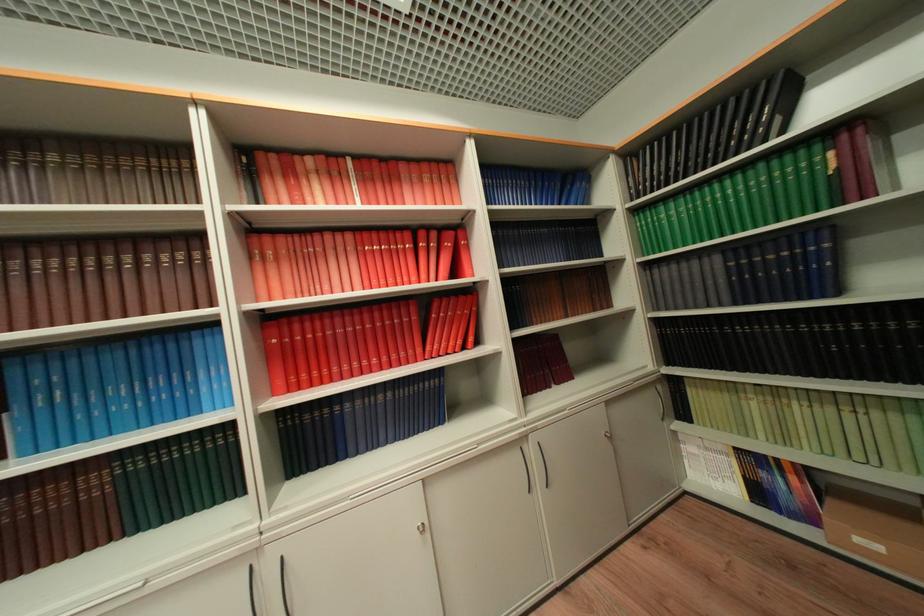
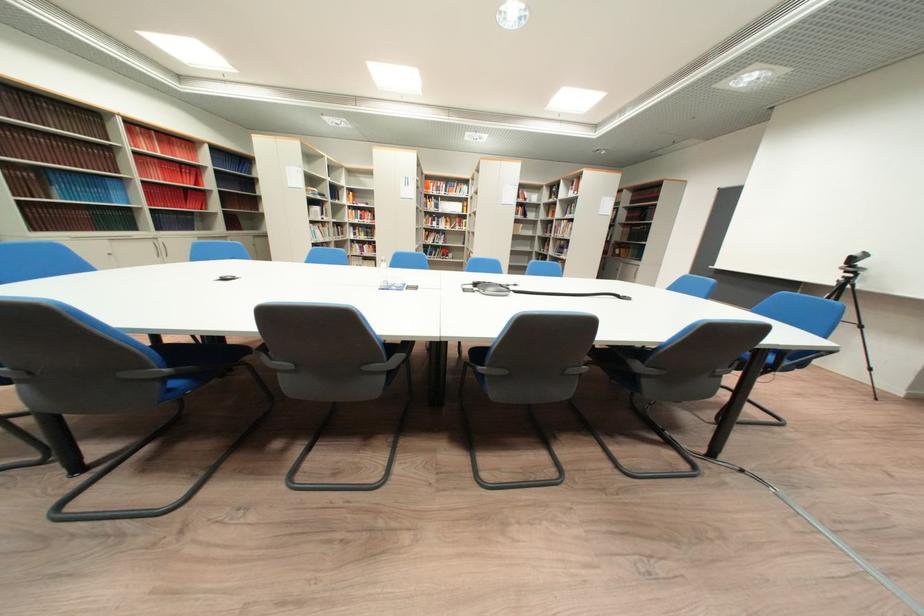
Question: I am providing you with two images of the same scene from different viewpoints. After the viewpoint changes to image2, which objects are now occluded?

Choices:
 (A) kettlebell handle
 (B) book
 (C) glass water bottle
 (D) green book

Answer: (D)